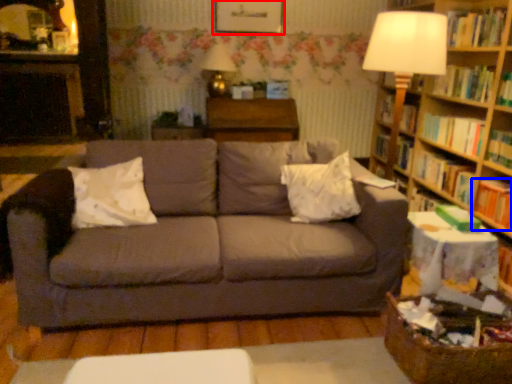
Question: Which of the following is the farthest to the observer, picture frame (highlighted by a red box) or book (highlighted by a blue box)?

Choices:
 (A) picture frame
 (B) book

Answer: (A)